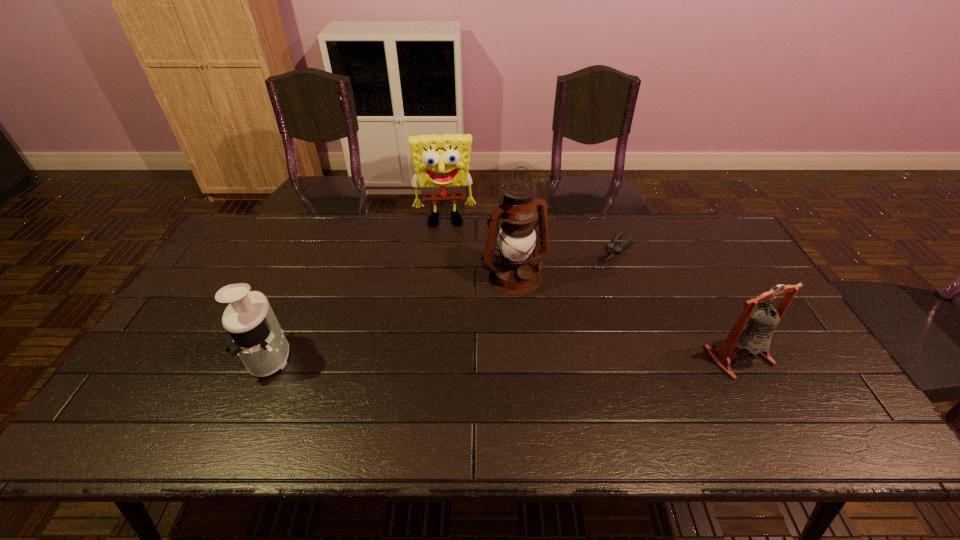
This screenshot has height=540, width=960. Identify the location of free space on the desktop that is between the juicer and the bell and is positioned on the side of the lantern, there is a wick adjustment knob. (561, 356).

The image size is (960, 540). In order to click on vacant space on the desktop that is between the leftmost object and the bell and is positioned on the face of the farthest object in this screenshot , I will do `click(447, 356)`.

At what (x,y) coordinates should I click in order to perform the action: click on free space on the desktop that is between the leftmost object and the rightmost object and is positioned at the gripping part of the pliers. Please return your answer as a coordinate pair (x, y). The height and width of the screenshot is (540, 960). Looking at the image, I should click on (513, 356).